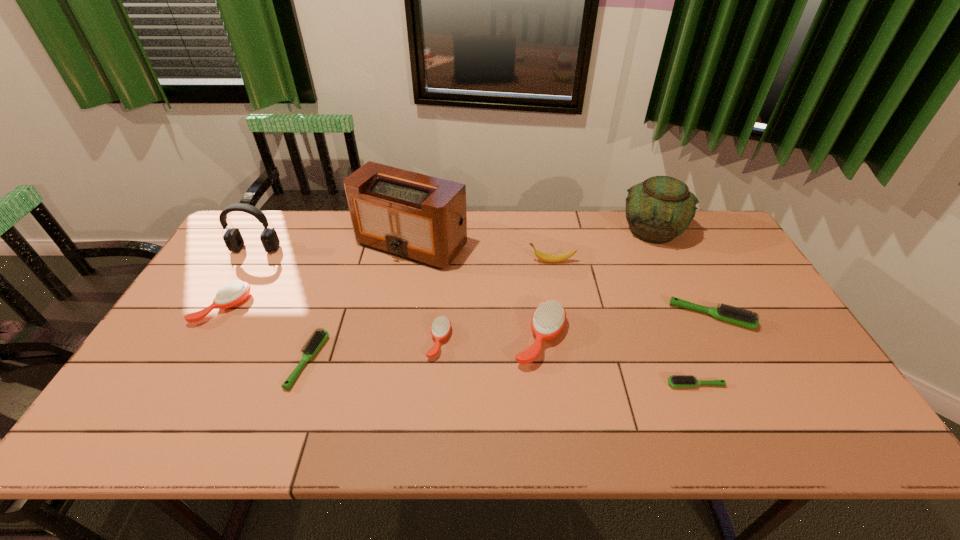
Find the location of a particular element. This screenshot has width=960, height=540. the smallest orange hairbrush is located at coordinates (441, 326).

At what (x,y) coordinates should I click in order to perform the action: click on the second shortest object. Please return your answer as a coordinate pair (x, y). This screenshot has height=540, width=960. Looking at the image, I should click on (316, 341).

Find the location of a particular element. This screenshot has height=540, width=960. the leftmost light hairbrush is located at coordinates (316, 341).

Where is `the smallest light hairbrush`? the smallest light hairbrush is located at coordinates (677, 381).

Locate an element on the screen. the shortest hairbrush is located at coordinates (677, 381).

Where is `vacant area situated 0.060m on the right of the tallest object`? This screenshot has height=540, width=960. vacant area situated 0.060m on the right of the tallest object is located at coordinates (486, 244).

You are a GUI agent. You are given a task and a screenshot of the screen. Output one action in this format:
    pyautogui.click(x=<x>, y=<y>)
    Task: Click on the free space located 0.360m on the left of the pottery
    
    Given the screenshot: What is the action you would take?
    pyautogui.click(x=515, y=231)

At what (x,y) coordinates should I click in order to perform the action: click on vacant space located on the headband of the headset. Please return your answer as a coordinate pair (x, y). The height and width of the screenshot is (540, 960). Looking at the image, I should click on (195, 353).

The width and height of the screenshot is (960, 540). I want to click on free spot located 0.100m at the stem of the yellow banana, so click(x=496, y=261).

Locate an element on the screen. The height and width of the screenshot is (540, 960). vacant space located at the stem of the yellow banana is located at coordinates (477, 261).